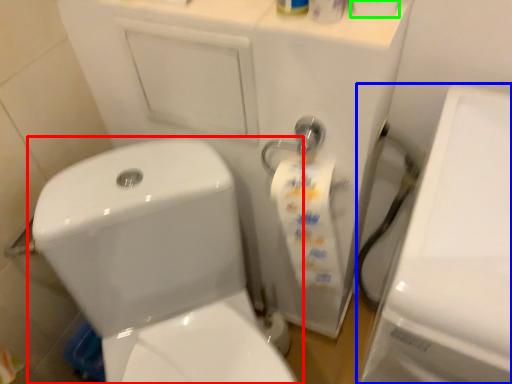
Question: Which object is the closest to the toilet (highlighted by a red box)? Choose among these: porcelain (highlighted by a blue box) or toilet paper (highlighted by a green box).

Choices:
 (A) porcelain
 (B) toilet paper

Answer: (A)